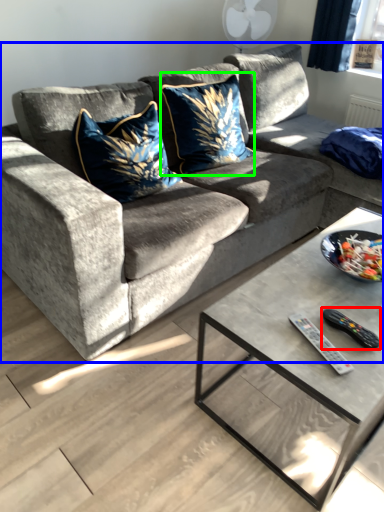
Question: Which object is the farthest from remote (highlighted by a red box)? Choose among these: studio couch (highlighted by a blue box) or throw pillow (highlighted by a green box).

Choices:
 (A) studio couch
 (B) throw pillow

Answer: (B)